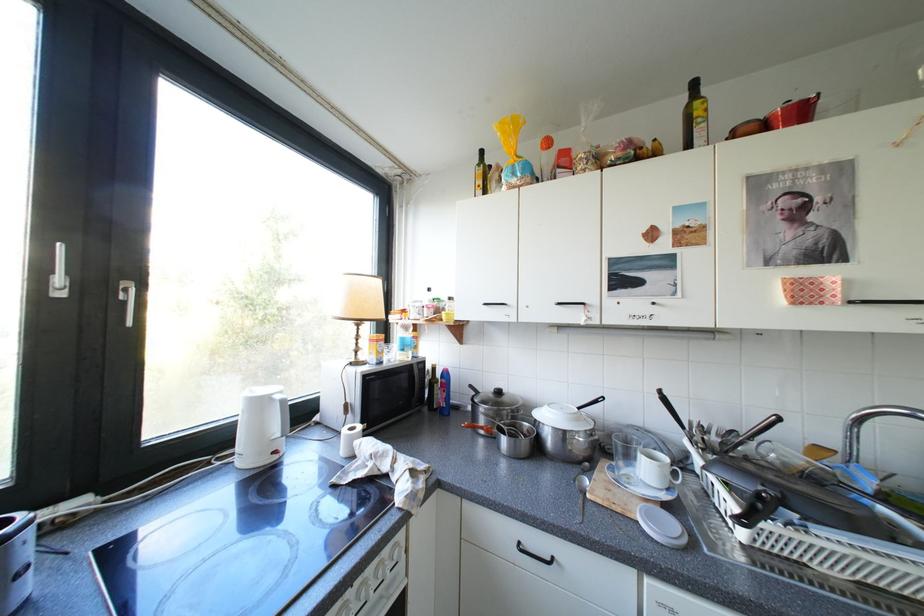
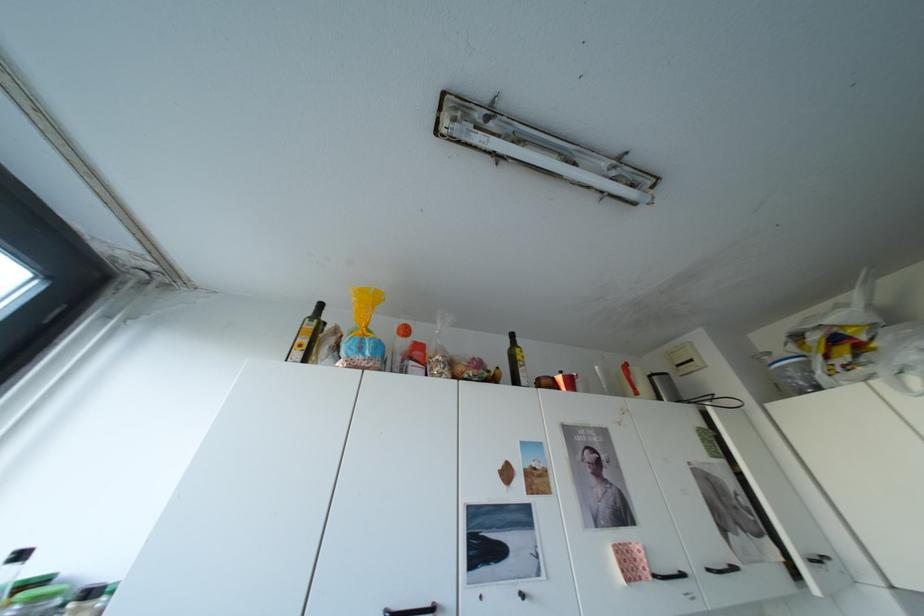
Find the pixel in the second image that matches [492,192] in the first image.

(310, 353)